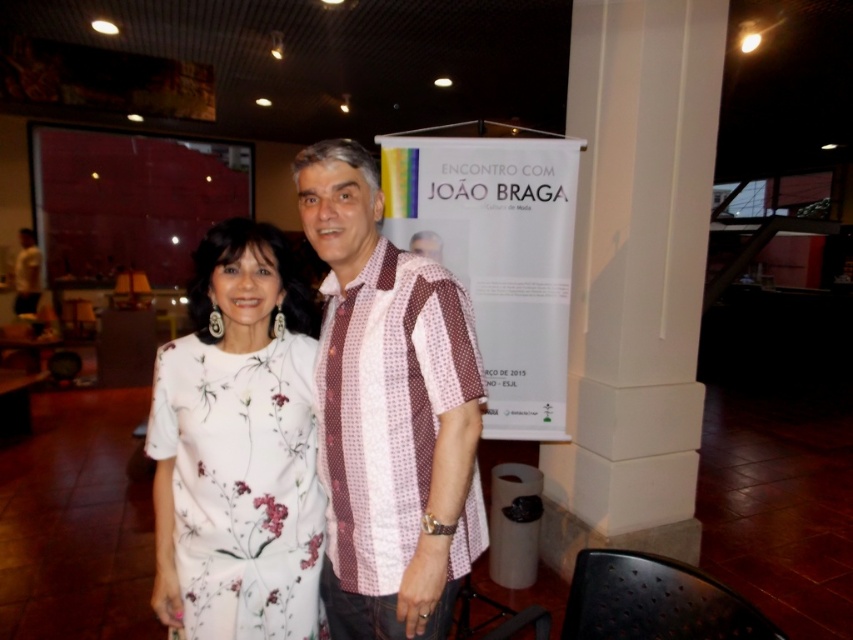
Question: Does white smooth pillar at center have a smaller size compared to patterned fabric shirt at center?

Choices:
 (A) no
 (B) yes

Answer: (A)

Question: Is white smooth pillar at center to the right of white floral dress at center from the viewer's perspective?

Choices:
 (A) yes
 (B) no

Answer: (A)

Question: Based on their relative distances, which object is farther from the patterned fabric shirt at center?

Choices:
 (A) white smooth pillar at center
 (B) white floral dress at center

Answer: (A)

Question: Among these points, which one is nearest to the camera?

Choices:
 (A) (602, 308)
 (B) (407, 579)

Answer: (B)

Question: Which object appears closest to the camera in this image?

Choices:
 (A) patterned fabric shirt at center
 (B) white floral dress at center

Answer: (A)

Question: Considering the relative positions of patterned fabric shirt at center and white floral dress at center in the image provided, where is patterned fabric shirt at center located with respect to white floral dress at center?

Choices:
 (A) left
 (B) right

Answer: (B)